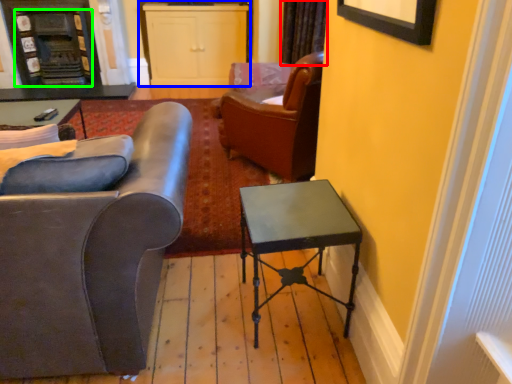
Question: Estimate the real-world distances between objects in this image. Which object is farther from curtain (highlighted by a red box), cabinetry (highlighted by a blue box) or fireplace (highlighted by a green box)?

Choices:
 (A) cabinetry
 (B) fireplace

Answer: (B)